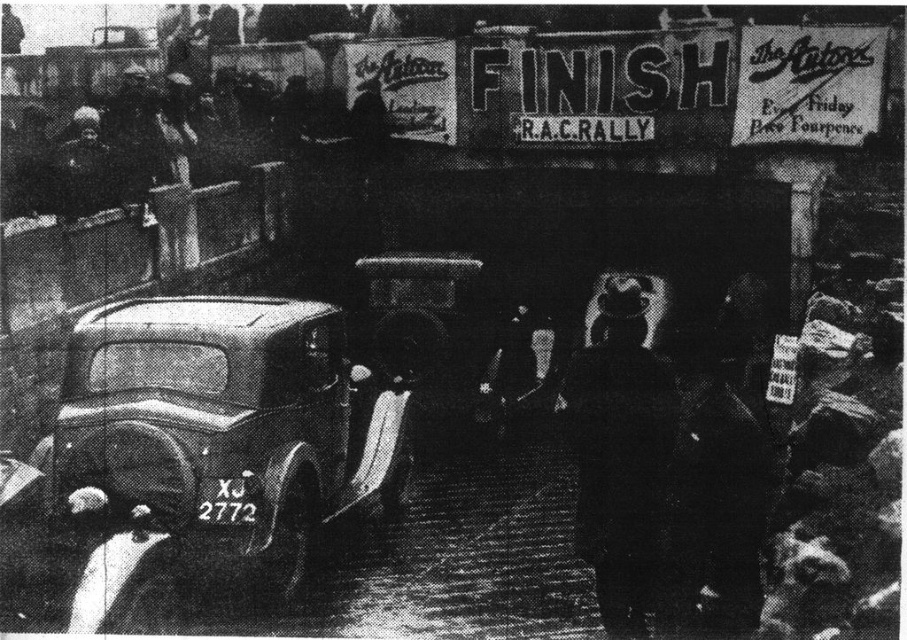
Who is higher up, metallic silver car at center or dark wool coat at center?

metallic silver car at center is higher up.

Measure the distance between metallic silver car at center and camera.

The distance of metallic silver car at center from camera is 5.79 meters.

Identify the location of metallic silver car at center. (225, 428).